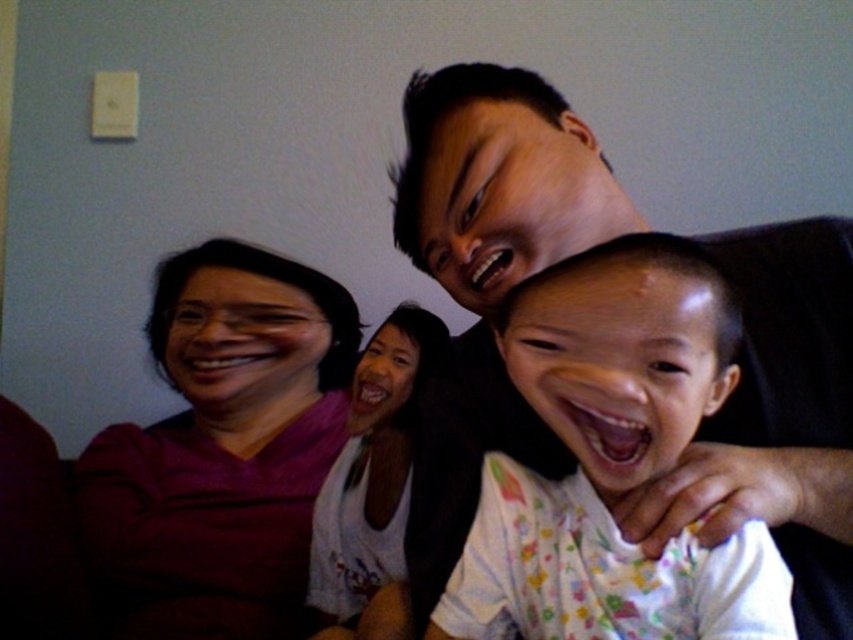
You are a photographer setting up for a group photo. You need to ensure that the black matte shirt at upper right and the purple matte shirt at left are at least 20 inches apart for proper framing. Based on the scene description, can you confirm if they meet this requirement?

The distance between the black matte shirt at upper right and the purple matte shirt at left is 21.58 inches, which exceeds the minimum requirement of 20 inches. Therefore, they meet the requirement for proper framing.

You are trying to decide which shirt to choose for a casual day out. Based on the image, which of the two shirts, the black matte shirt at upper right or the white cotton shirt at center, would allow for more comfortable movement due to its width?

The black matte shirt at upper right might be wider than white cotton shirt at center, so it could provide more comfortable movement.

Looking at this image, you are a photographer setting up for a family portrait. You need to position the purple matte shirt at left and the white cotton shirt at center so that both are visible in the frame. Based on their current positions, which one is lower and might be partially hidden if not adjusted?

The purple matte shirt at left is below the white cotton shirt at center, so it might be partially hidden if not adjusted.